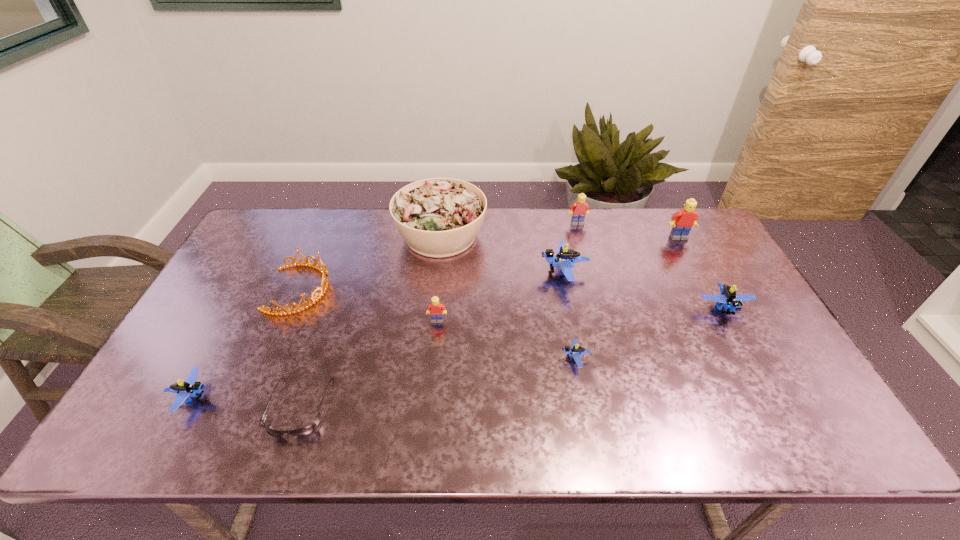
You are a GUI agent. You are given a task and a screenshot of the screen. Output one action in this format:
    pyautogui.click(x=<x>, y=<y>)
    Task: Click on the salad
    
    Given the screenshot: What is the action you would take?
    pyautogui.click(x=438, y=217)

Where is `the sixth nearest Lego`? The image size is (960, 540). the sixth nearest Lego is located at coordinates (682, 221).

Find the location of a particular element. The width and height of the screenshot is (960, 540). the biggest yellow Lego is located at coordinates (682, 221).

Where is `the second biggest yellow Lego`? the second biggest yellow Lego is located at coordinates (579, 208).

Identify the location of the second yellow Lego from left to right. The height and width of the screenshot is (540, 960). click(579, 208).

This screenshot has width=960, height=540. In order to click on the biggest blue Lego in this screenshot , I will do `click(565, 258)`.

In order to click on tiara in this screenshot , I will do tap(324, 285).

Find the location of a particular element. Image resolution: width=960 pixels, height=540 pixels. the third smallest blue Lego is located at coordinates (732, 302).

The width and height of the screenshot is (960, 540). Find the location of `the smallest yellow Lego`. the smallest yellow Lego is located at coordinates (435, 308).

You are a GUI agent. You are given a task and a screenshot of the screen. Output one action in this format:
    pyautogui.click(x=<x>, y=<y>)
    Task: Click on the leftmost yellow Lego
    
    Given the screenshot: What is the action you would take?
    pyautogui.click(x=435, y=308)